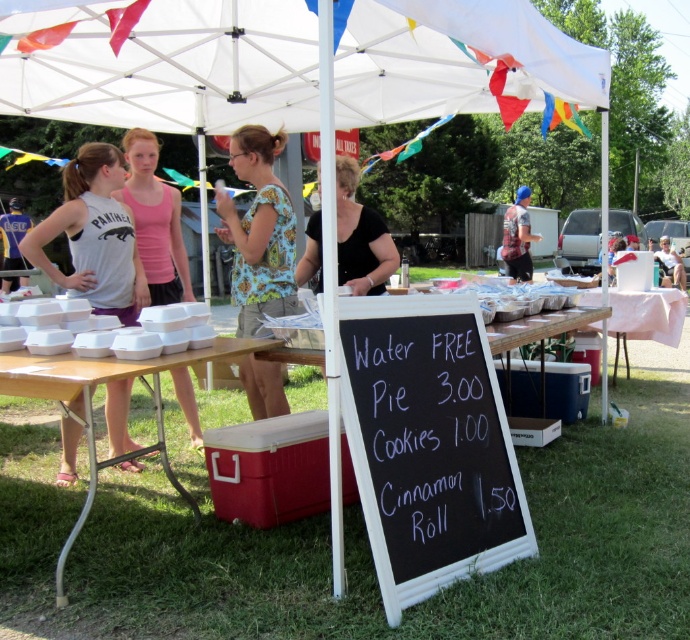
Which of these two, white plastic cooler at lower center or blue knit cap at upper center, stands taller?

blue knit cap at upper center is taller.

From the picture: Does white plastic cooler at lower center appear on the left side of blue knit cap at upper center?

Yes, white plastic cooler at lower center is to the left of blue knit cap at upper center.

This screenshot has width=690, height=640. What do you see at coordinates (90, 406) in the screenshot?
I see `white plastic cooler at lower center` at bounding box center [90, 406].

In order to click on white plastic cooler at lower center in this screenshot , I will do `click(90, 406)`.

Is black chalkboard at center further to camera compared to black matte shirt at center?

No, it is in front of black matte shirt at center.

Looking at this image, between black chalkboard at center and black matte shirt at center, which one appears on the right side from the viewer's perspective?

Positioned to the right is black chalkboard at center.

What are the coordinates of `black chalkboard at center` in the screenshot? It's located at (428, 444).

Where is `black chalkboard at center`? This screenshot has width=690, height=640. black chalkboard at center is located at coordinates (428, 444).

Based on the photo, measure the distance from floral fabric blouse at center to pink fabric shirt at left.

A distance of 29.18 inches exists between floral fabric blouse at center and pink fabric shirt at left.

Does point (228, 148) come in front of point (157, 208)?

No, it is not.

Identify the location of floral fabric blouse at center. (259, 230).

Image resolution: width=690 pixels, height=640 pixels. In order to click on floral fabric blouse at center in this screenshot , I will do `click(259, 230)`.